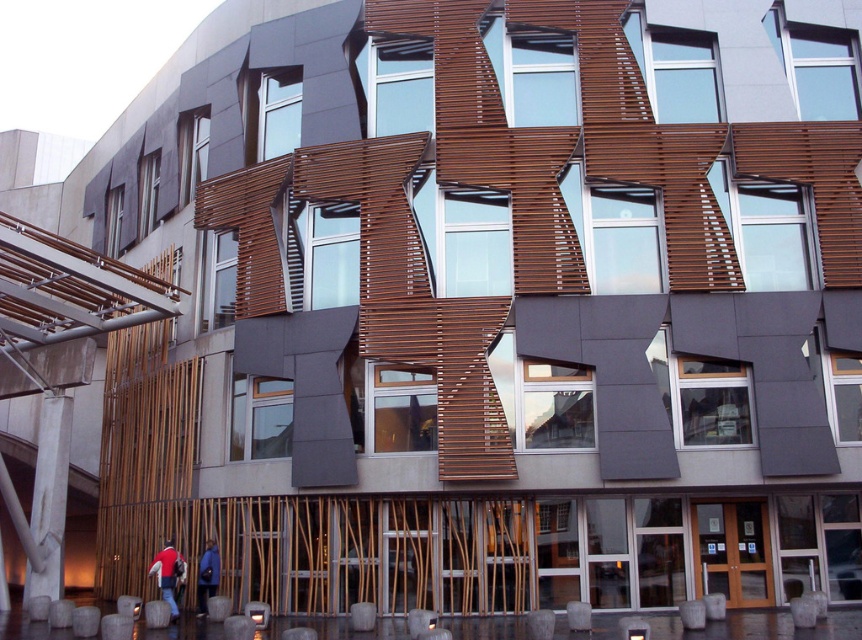
Question: Does red fabric jacket at lower left have a lesser width compared to blue fabric jacket at lower center?

Choices:
 (A) no
 (B) yes

Answer: (A)

Question: Which of the following is the farthest from the observer?

Choices:
 (A) (176, 616)
 (B) (209, 570)

Answer: (B)

Question: Does red fabric jacket at lower left have a smaller size compared to blue fabric jacket at lower center?

Choices:
 (A) yes
 (B) no

Answer: (B)

Question: Which point is closer to the camera?

Choices:
 (A) (205, 564)
 (B) (148, 572)

Answer: (A)

Question: Is red fabric jacket at lower left closer to camera compared to blue fabric jacket at lower center?

Choices:
 (A) no
 (B) yes

Answer: (B)